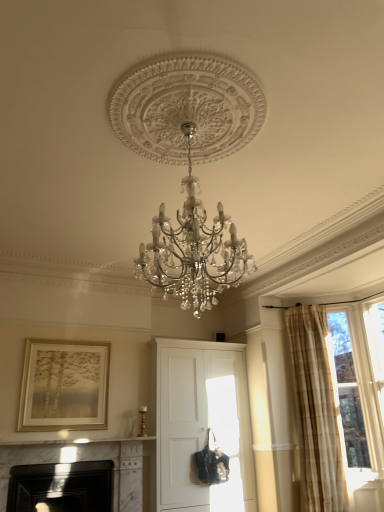
Question: In terms of width, does black marble fireplace at lower left, arranged as the second fireplace when viewed from the right, look wider or thinner when compared to white matte cabinet at center?

Choices:
 (A) wide
 (B) thin

Answer: (B)

Question: Is black marble fireplace at lower left, the 1th fireplace positioned from the left, taller or shorter than white matte cabinet at center?

Choices:
 (A) short
 (B) tall

Answer: (A)

Question: Which of these objects is positioned closest to the beige plaid curtain at right?

Choices:
 (A) white marble fireplace at lower left, placed as the second fireplace when sorted from left to right
 (B) black marble fireplace at lower left, the 1th fireplace positioned from the left
 (C) clear glass window at upper right
 (D) gold metallic picture frame at upper left
 (E) white matte cabinet at center

Answer: (C)

Question: Which of these objects is positioned farthest from the clear glass window at upper right?

Choices:
 (A) white marble fireplace at lower left, which appears as the 1th fireplace when viewed from the right
 (B) gold metallic picture frame at upper left
 (C) white matte cabinet at center
 (D) beige plaid curtain at right
 (E) black marble fireplace at lower left, the 1th fireplace positioned from the left

Answer: (E)